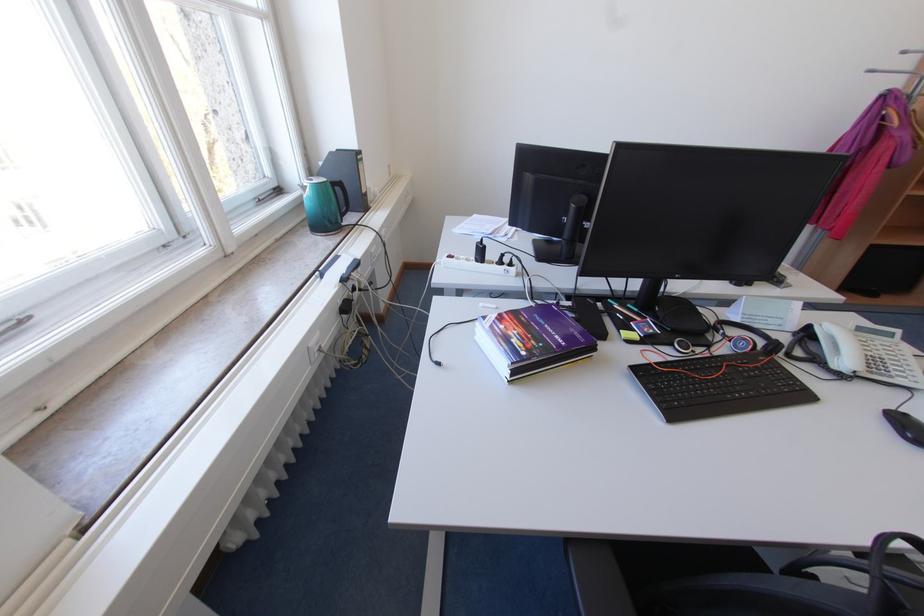
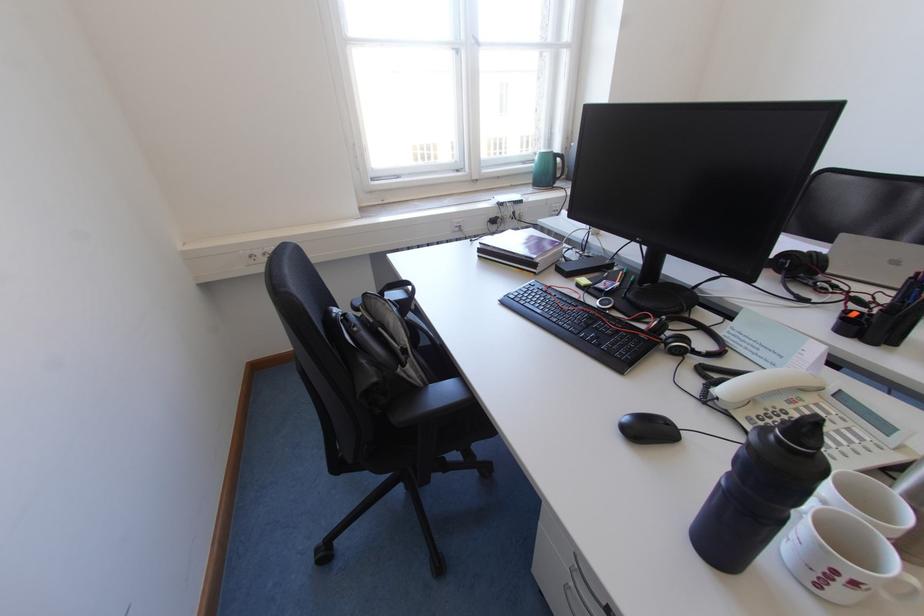
Find the pixel in the second image that matches (x=824, y=362) in the first image.

(723, 384)